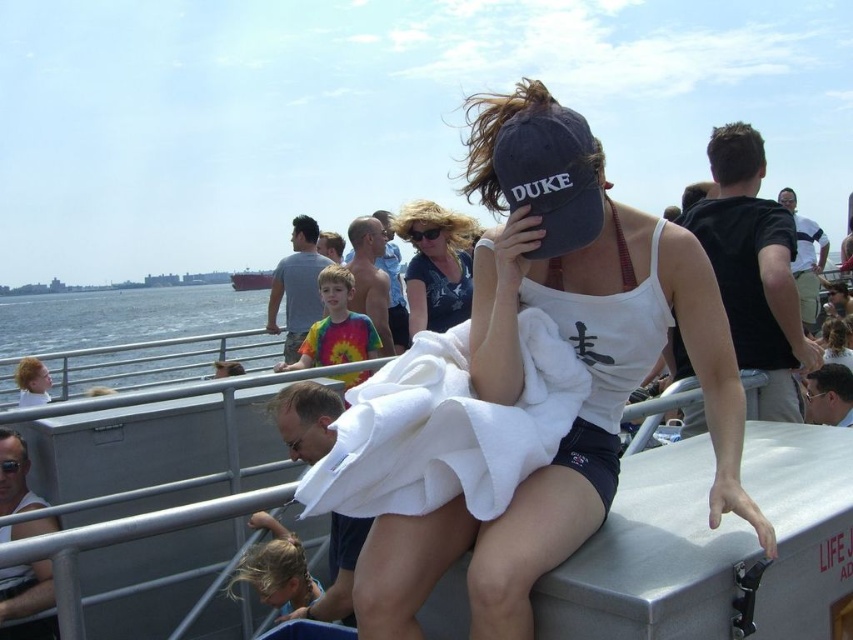
Question: Which point appears farthest from the camera in this image?

Choices:
 (A) (683, 484)
 (B) (460, 317)
 (C) (572, 234)

Answer: (B)

Question: Is the position of matte black cap at center less distant than that of matte black baseball cap at center?

Choices:
 (A) yes
 (B) no

Answer: (A)

Question: Which of the following is the farthest from the observer?

Choices:
 (A) (815, 460)
 (B) (244, 273)
 (C) (607, 340)

Answer: (B)

Question: Estimate the real-world distances between objects in this image. Which object is closer to the matte black baseball cap at center?

Choices:
 (A) matte black cap at center
 (B) reddish-brown wooden ship at center
 (C) blue water at lower left
 (D) matte blue baseball cap at center

Answer: (A)

Question: Can you confirm if matte black baseball cap at center is positioned above reddish-brown wooden ship at center?

Choices:
 (A) yes
 (B) no

Answer: (B)

Question: Can you confirm if matte black cap at center is smaller than blue water at lower left?

Choices:
 (A) yes
 (B) no

Answer: (A)